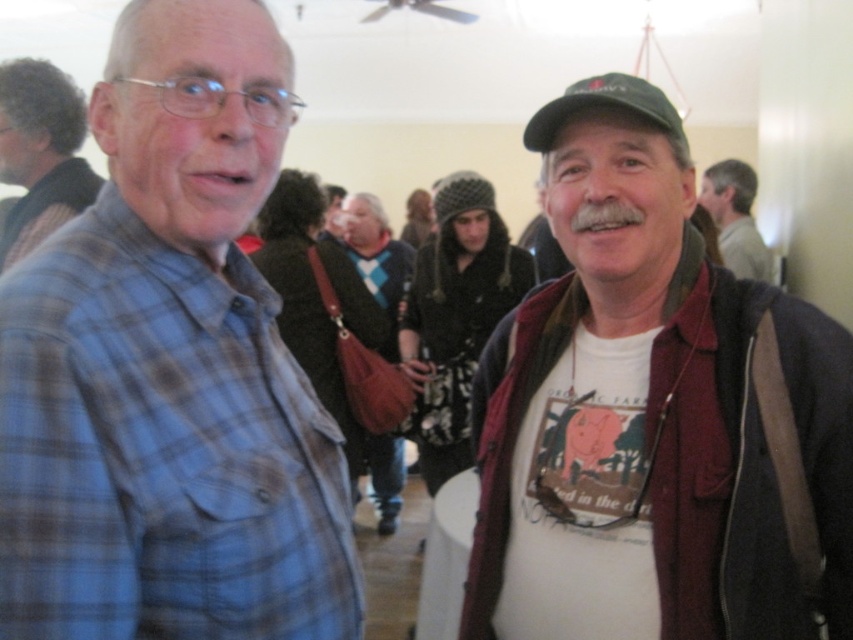
Which is more to the right, blue plaid shirt at left or gray knit cap at upper right?

From the viewer's perspective, gray knit cap at upper right appears more on the right side.

Between blue plaid shirt at left and gray knit cap at upper right, which one has less height?

gray knit cap at upper right

The height and width of the screenshot is (640, 853). What are the coordinates of `blue plaid shirt at left` in the screenshot? It's located at (169, 369).

Which is behind, point (57, 346) or point (473, 564)?

Point (473, 564)

Is the position of blue plaid shirt at left more distant than that of matte green cap at center?

That is False.

Is point (41, 330) positioned before point (535, 467)?

That is True.

Identify the location of blue plaid shirt at left. (169, 369).

Between gray plaid shirt at left and brown leather bag at center, which one is positioned higher?

gray plaid shirt at left is higher up.

Does gray plaid shirt at left lie in front of brown leather bag at center?

Yes, it is in front of brown leather bag at center.

Between point (30, 212) and point (396, 355), which one is positioned behind?

Positioned behind is point (396, 355).

At what (x,y) coordinates should I click in order to perform the action: click on gray plaid shirt at left. Please return your answer as a coordinate pair (x, y). This screenshot has width=853, height=640. Looking at the image, I should click on (39, 154).